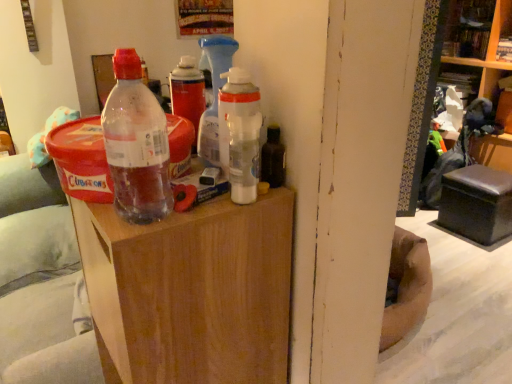
Locate an element on the screen. wooden bookshelf at upper right, the 2th shelf viewed from the top is located at coordinates (484, 66).

Which object is positioned more to the right, wooden bookshelf at upper right, the second shelf ordered from the bottom, or wooden side table at center?

From the viewer's perspective, wooden bookshelf at upper right, the second shelf ordered from the bottom, appears more on the right side.

From a real-world perspective, who is located higher, wooden bookshelf at upper right, the second shelf ordered from the bottom, or wooden side table at center?

wooden bookshelf at upper right, the second shelf ordered from the bottom, from a real-world perspective.

Consider the image. Is wooden bookshelf at upper right, the second shelf ordered from the bottom, aimed at wooden side table at center?

No, wooden bookshelf at upper right, the second shelf ordered from the bottom, is not aimed at wooden side table at center.

Considering the sizes of objects wooden bookshelf at upper right, the 1th shelf from the top, and wooden side table at center in the image provided, who is smaller, wooden bookshelf at upper right, the 1th shelf from the top, or wooden side table at center?

Smaller between the two is wooden bookshelf at upper right, the 1th shelf from the top.

Can you confirm if wooden bookshelf at upper right, the second shelf ordered from the bottom, is shorter than translucent plastic bottle at center?

Incorrect, the height of wooden bookshelf at upper right, the second shelf ordered from the bottom, does not fall short of that of translucent plastic bottle at center.

Between wooden bookshelf at upper right, the 1th shelf from the top, and translucent plastic bottle at center, which one appears on the left side from the viewer's perspective?

From the viewer's perspective, translucent plastic bottle at center appears more on the left side.

From the image's perspective, is wooden bookshelf at upper right, the second shelf ordered from the bottom, above or below translucent plastic bottle at center?

Clearly, from the image's perspective, wooden bookshelf at upper right, the second shelf ordered from the bottom, is above translucent plastic bottle at center.

Which of these two, wooden side table at center or translucent plastic bottle at center, stands shorter?

With less height is translucent plastic bottle at center.

The image size is (512, 384). Identify the location of bottle located above the wooden side table at center (from the image's perspective). (136, 144).

Is wooden side table at center positioned far away from translucent plastic bottle at center?

Actually, wooden side table at center and translucent plastic bottle at center are a little close together.

Does point (257, 266) come farther from viewer compared to point (133, 181)?

That is True.

Is translucent plastic bottle at center taller than wooden side table at center?

No.

Considering the relative positions of translucent plastic bottle at center and wooden side table at center in the image provided, is translucent plastic bottle at center to the left of wooden side table at center from the viewer's perspective?

Correct, you'll find translucent plastic bottle at center to the left of wooden side table at center.

From the image's perspective, is translucent plastic bottle at center above or below wooden side table at center?

Clearly, from the image's perspective, translucent plastic bottle at center is above wooden side table at center.

Looking at this image, considering the sizes of objects translucent plastic bottle at center and wooden side table at center in the image provided, who is smaller, translucent plastic bottle at center or wooden side table at center?

Smaller between the two is translucent plastic bottle at center.

From the picture: Is wooden bookshelf at upper right, acting as the first shelf starting from the bottom, spatially inside translucent plastic bottle at center, or outside of it?

wooden bookshelf at upper right, acting as the first shelf starting from the bottom, lies outside translucent plastic bottle at center.

Is wooden bookshelf at upper right, the 2th shelf viewed from the top, bigger than translucent plastic bottle at center?

Yes, wooden bookshelf at upper right, the 2th shelf viewed from the top, is bigger than translucent plastic bottle at center.

Is wooden bookshelf at upper right, the 2th shelf viewed from the top, taller or shorter than translucent plastic bottle at center?

In the image, wooden bookshelf at upper right, the 2th shelf viewed from the top, appears to be taller than translucent plastic bottle at center.

Is wooden bookshelf at upper right, the second shelf ordered from the bottom, in contact with wooden bookshelf at upper right, acting as the first shelf starting from the bottom?

Absolutely, wooden bookshelf at upper right, the second shelf ordered from the bottom, is next to and touching wooden bookshelf at upper right, acting as the first shelf starting from the bottom.

Does wooden bookshelf at upper right, the second shelf ordered from the bottom, have a smaller size compared to wooden bookshelf at upper right, acting as the first shelf starting from the bottom?

Yes.

From their relative heights in the image, would you say wooden bookshelf at upper right, the second shelf ordered from the bottom, is taller or shorter than wooden bookshelf at upper right, acting as the first shelf starting from the bottom?

Considering their sizes, wooden bookshelf at upper right, the second shelf ordered from the bottom, has less height than wooden bookshelf at upper right, acting as the first shelf starting from the bottom.

Is point (511, 2) more distant than point (499, 22)?

That is False.

Which shelf is the 1st one when counting from the right side of the wooden side table at center? Please provide its 2D coordinates.

[(476, 28)]

Does point (130, 308) come farther from viewer compared to point (447, 40)?

No, (130, 308) is closer to viewer.

Is the surface of wooden side table at center in direct contact with wooden bookshelf at upper right, the second shelf ordered from the bottom?

No, wooden side table at center is not in contact with wooden bookshelf at upper right, the second shelf ordered from the bottom.

From a real-world perspective, is wooden side table at center positioned above or below wooden bookshelf at upper right, the 1th shelf from the top?

From a real-world perspective, wooden side table at center is physically below wooden bookshelf at upper right, the 1th shelf from the top.

You are a GUI agent. You are given a task and a screenshot of the screen. Output one action in this format:
    pyautogui.click(x=<x>, y=<y>)
    Task: Click on the shelf above the wooden side table at center (from a real-world perspective)
    
    Given the screenshot: What is the action you would take?
    pyautogui.click(x=476, y=28)

I want to click on shelf that is the 1st object to the right of the translucent plastic bottle at center, starting at the anchor, so click(x=476, y=28).

Looking at the image, which one is located further to wooden side table at center, wooden bookshelf at upper right, the 1th shelf from the top, or translucent plastic bottle at center?

Based on the image, wooden bookshelf at upper right, the 1th shelf from the top, appears to be further to wooden side table at center.

Which object lies further to the anchor point wooden bookshelf at upper right, the 2th shelf viewed from the top, wooden side table at center or wooden bookshelf at upper right, the second shelf ordered from the bottom?

Among the two, wooden side table at center is located further to wooden bookshelf at upper right, the 2th shelf viewed from the top.

Based on the photo, based on their spatial positions, is wooden bookshelf at upper right, the second shelf ordered from the bottom, or wooden side table at center further from translucent plastic bottle at center?

wooden bookshelf at upper right, the second shelf ordered from the bottom, lies further to translucent plastic bottle at center than the other object.

Considering their positions, is wooden bookshelf at upper right, acting as the first shelf starting from the bottom, positioned further to translucent plastic bottle at center than wooden bookshelf at upper right, the 1th shelf from the top?

Among the two, wooden bookshelf at upper right, the 1th shelf from the top, is located further to translucent plastic bottle at center.

Based on their spatial positions, is wooden bookshelf at upper right, the 2th shelf viewed from the top, or wooden side table at center further from translucent plastic bottle at center?

wooden bookshelf at upper right, the 2th shelf viewed from the top, is positioned further to the anchor translucent plastic bottle at center.

Estimate the real-world distances between objects in this image. Which object is further from wooden side table at center, wooden bookshelf at upper right, acting as the first shelf starting from the bottom, or translucent plastic bottle at center?

Among the two, wooden bookshelf at upper right, acting as the first shelf starting from the bottom, is located further to wooden side table at center.

Based on their spatial positions, is wooden side table at center or translucent plastic bottle at center further from wooden bookshelf at upper right, the 2th shelf viewed from the top?

translucent plastic bottle at center lies further to wooden bookshelf at upper right, the 2th shelf viewed from the top, than the other object.

When comparing their distances from wooden bookshelf at upper right, the 1th shelf from the top, does wooden side table at center or wooden bookshelf at upper right, the 2th shelf viewed from the top, seem closer?

wooden bookshelf at upper right, the 2th shelf viewed from the top, lies closer to wooden bookshelf at upper right, the 1th shelf from the top, than the other object.

This screenshot has width=512, height=384. What are the coordinates of `furniture located between translucent plastic bottle at center and wooden bookshelf at upper right, acting as the first shelf starting from the bottom, in the depth direction` in the screenshot? It's located at (191, 292).

Image resolution: width=512 pixels, height=384 pixels. In order to click on shelf between translucent plastic bottle at center and wooden bookshelf at upper right, the 1th shelf from the top, in the front-back direction in this screenshot , I will do `click(484, 66)`.

Where is `furniture located between translucent plastic bottle at center and wooden bookshelf at upper right, the 1th shelf from the top, in the depth direction`? The width and height of the screenshot is (512, 384). furniture located between translucent plastic bottle at center and wooden bookshelf at upper right, the 1th shelf from the top, in the depth direction is located at coordinates click(x=191, y=292).

The height and width of the screenshot is (384, 512). Find the location of `shelf between wooden side table at center and wooden bookshelf at upper right, the second shelf ordered from the bottom, in the front-back direction`. shelf between wooden side table at center and wooden bookshelf at upper right, the second shelf ordered from the bottom, in the front-back direction is located at coordinates (484, 66).